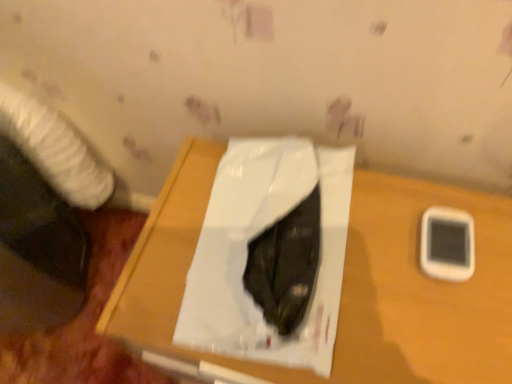
Question: Should I look upward or downward to see white glossy paper at center?

Choices:
 (A) down
 (B) up

Answer: (A)

Question: From the image's perspective, does wooden table at center appear higher than white glossy paper at center?

Choices:
 (A) yes
 (B) no

Answer: (B)

Question: Is wooden table at center positioned beyond the bounds of white glossy paper at center?

Choices:
 (A) yes
 (B) no

Answer: (A)

Question: Is wooden table at center wider than white glossy paper at center?

Choices:
 (A) no
 (B) yes

Answer: (B)

Question: Considering the relative sizes of wooden table at center and white glossy paper at center in the image provided, is wooden table at center shorter than white glossy paper at center?

Choices:
 (A) yes
 (B) no

Answer: (B)

Question: From a real-world perspective, does wooden table at center sit lower than white glossy paper at center?

Choices:
 (A) yes
 (B) no

Answer: (A)

Question: Does wooden table at center have a greater height compared to white glossy paper at center?

Choices:
 (A) yes
 (B) no

Answer: (A)

Question: From a real-world perspective, is wooden table at center positioned over white plastic mobile phone at right based on gravity?

Choices:
 (A) yes
 (B) no

Answer: (B)

Question: Could you tell me if wooden table at center is facing white plastic mobile phone at right?

Choices:
 (A) no
 (B) yes

Answer: (A)

Question: Considering the relative positions of wooden table at center and white plastic mobile phone at right in the image provided, is wooden table at center to the left of white plastic mobile phone at right from the viewer's perspective?

Choices:
 (A) yes
 (B) no

Answer: (A)

Question: Is white plastic mobile phone at right located within wooden table at center?

Choices:
 (A) yes
 (B) no

Answer: (A)

Question: From a real-world perspective, is wooden table at center below white plastic mobile phone at right?

Choices:
 (A) yes
 (B) no

Answer: (A)

Question: Is wooden table at center located outside white plastic mobile phone at right?

Choices:
 (A) yes
 (B) no

Answer: (A)

Question: Is white plastic mobile phone at right at the left side of white glossy paper at center?

Choices:
 (A) no
 (B) yes

Answer: (A)